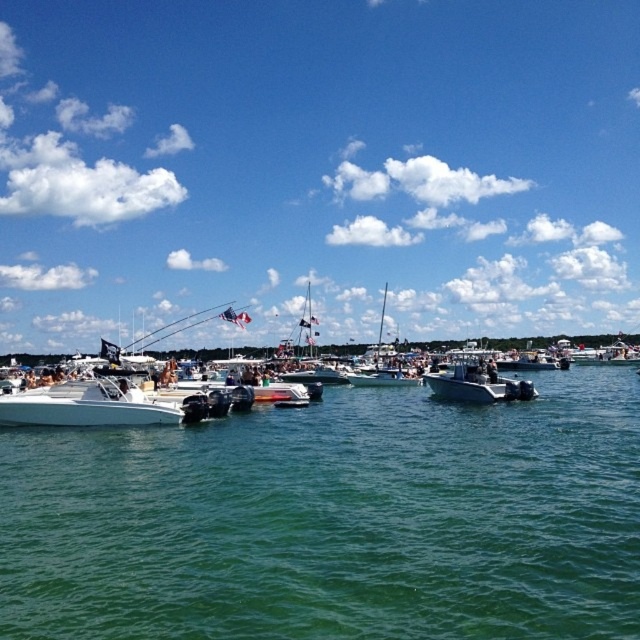
You are a photographer trying to capture a clear view of the boats at the marina. However, there is an object blocking your shot at point (317, 168). What is the object blocking your view at that point?

The object blocking your view at point (317, 168) is the transparent blue sky at upper center.